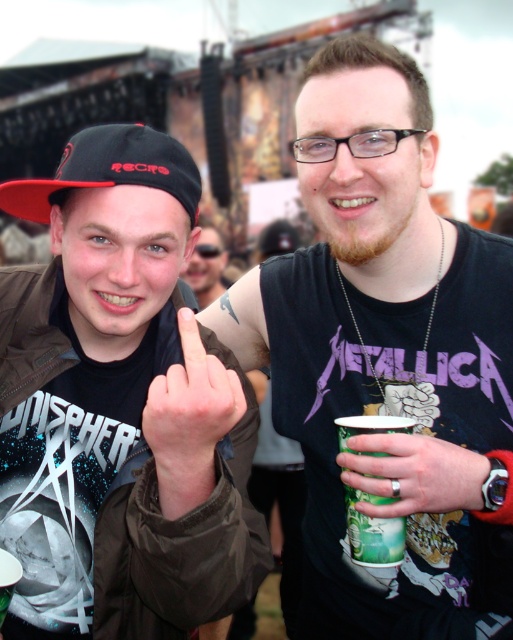
Question: Which point appears farthest from the camera in this image?

Choices:
 (A) (192, 566)
 (B) (161, 355)
 (C) (373, 547)
 (D) (459, 365)

Answer: (B)

Question: Which of the following is the closest to the observer?

Choices:
 (A) green paper cup at lower center
 (B) matte black cap at left

Answer: (B)

Question: Does matte black cap at left have a smaller size compared to skinny finger at center?

Choices:
 (A) no
 (B) yes

Answer: (A)

Question: Can you confirm if black matte t-shirt at center is positioned above skinny finger at center?

Choices:
 (A) no
 (B) yes

Answer: (A)

Question: Estimate the real-world distances between objects in this image. Which object is closer to the green paper cup at center?

Choices:
 (A) green paper cup at lower center
 (B) matte black cap at left

Answer: (A)

Question: Observing the image, what is the correct spatial positioning of green paper cup at center in reference to skinny finger at center?

Choices:
 (A) right
 (B) left

Answer: (A)